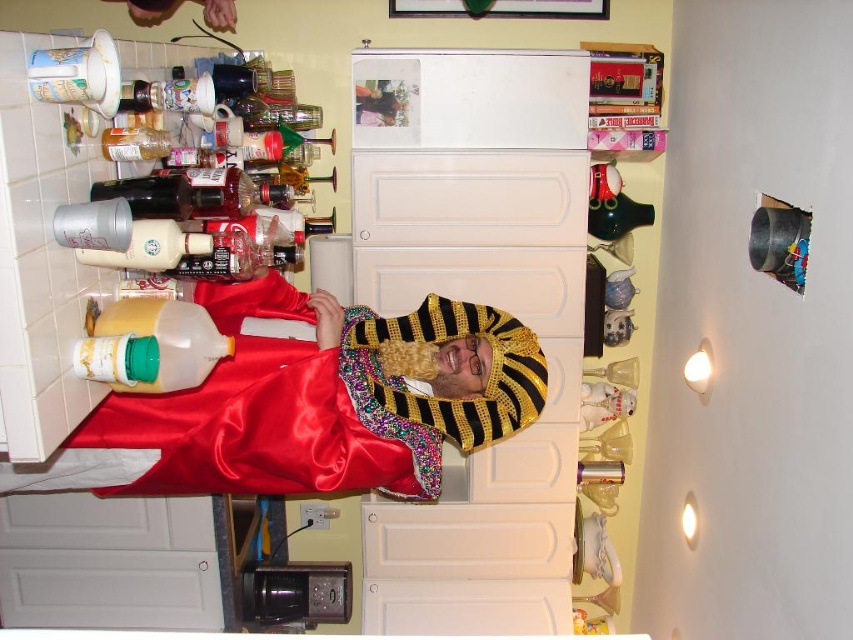
Measure the distance from satin gold headdress at center to yellow translucent jug at left.

13.19 inches

Who is more forward, (16, 490) or (189, 301)?

Result: Positioned in front is point (189, 301).

I want to click on satin gold headdress at center, so click(x=308, y=404).